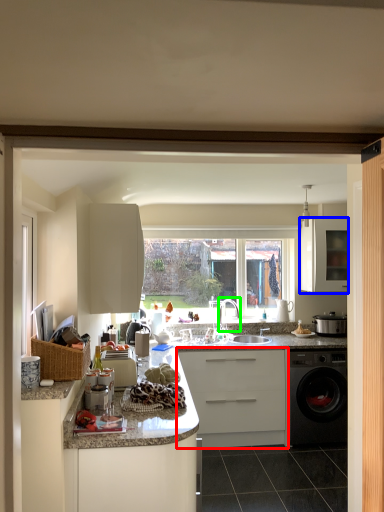
Question: Considering the real-world distances, which object is closest to cabinetry (highlighted by a red box)? cabinetry (highlighted by a blue box) or tap (highlighted by a green box).

Choices:
 (A) cabinetry
 (B) tap

Answer: (B)